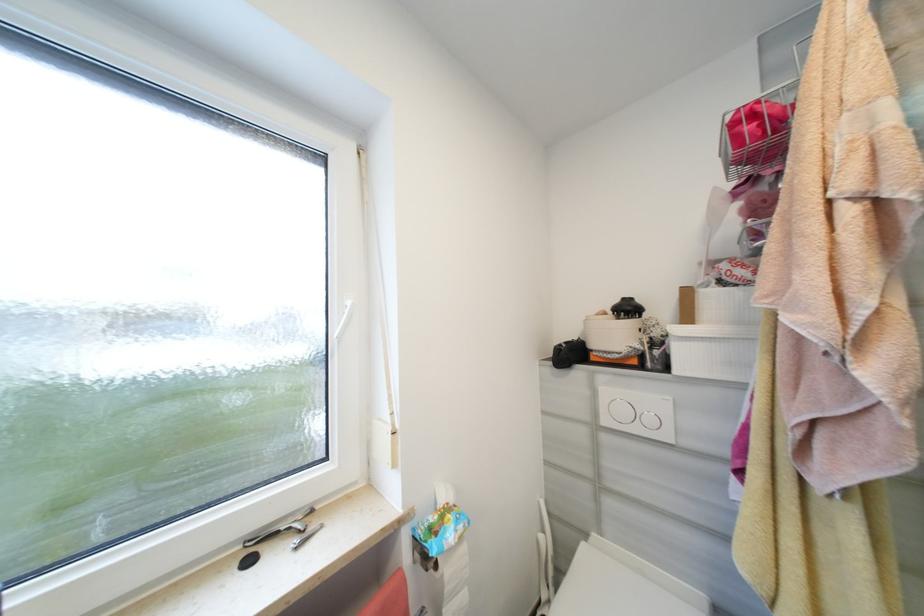
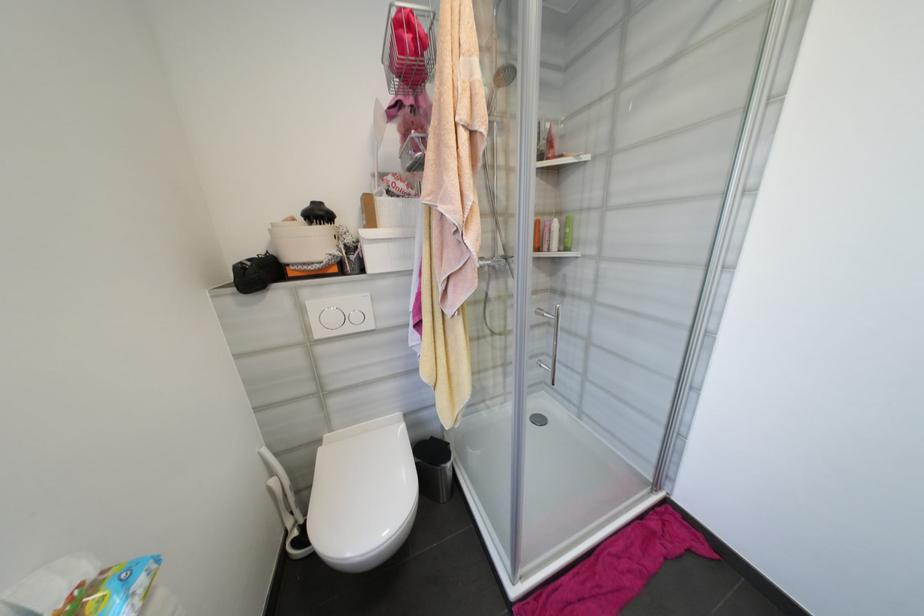
Find the pixel in the second image that matches the point at 591,537 in the first image.

(325, 443)